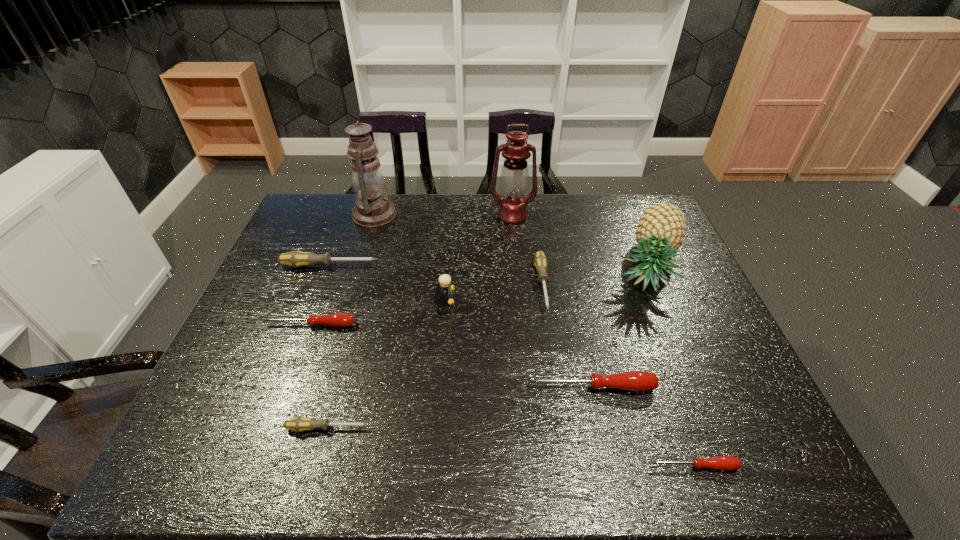
The image size is (960, 540). I want to click on gray screwdriver that is the third closest to the Lego, so click(298, 424).

Where is `gray screwdriver that is the third nearest to the farthest red screwdriver`? The width and height of the screenshot is (960, 540). gray screwdriver that is the third nearest to the farthest red screwdriver is located at coordinates (540, 261).

Locate which red screwdriver ranks third in proximity to the right oil lamp. Please provide its 2D coordinates. Your answer should be formatted as a tuple, i.e. [(x, y)], where the tuple contains the x and y coordinates of a point satisfying the conditions above.

[(726, 463)]

I want to click on the second closest red screwdriver to the biggest gray screwdriver, so click(x=633, y=380).

Find the location of a particular element. The image size is (960, 540). vacant area that satisfies the following two spatial constraints: 1. at the tip of the nearest gray screwdriver; 2. on the right side of the shortest screwdriver is located at coordinates (318, 466).

I want to click on free location that satisfies the following two spatial constraints: 1. at the tip of the nearest gray screwdriver; 2. on the right side of the shortest screwdriver, so click(318, 466).

Find the location of a particular element. Image resolution: width=960 pixels, height=540 pixels. free space in the image that satisfies the following two spatial constraints: 1. on the back side of the pineapple; 2. at the tip of the biggest gray screwdriver is located at coordinates [x=647, y=266].

I want to click on free space that satisfies the following two spatial constraints: 1. on the front side of the pineapple; 2. at the tip of the second nearest screwdriver, so click(x=714, y=428).

Identify the location of free spot that satisfies the following two spatial constraints: 1. at the tip of the biggest gray screwdriver; 2. on the right side of the third farthest screwdriver. (307, 325).

This screenshot has height=540, width=960. I want to click on blank space that satisfies the following two spatial constraints: 1. on the back side of the biggest red screwdriver; 2. on the right side of the third tallest object, so click(565, 266).